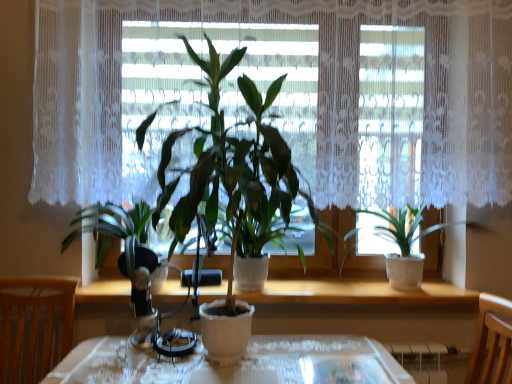
You are a GUI agent. You are given a task and a screenshot of the screen. Output one action in this format:
    pyautogui.click(x=<x>, y=<y>)
    Task: Click on the blank space situated above wooden at center (from a real-world perspective)
    The width and height of the screenshot is (512, 384).
    Given the screenshot: What is the action you would take?
    pyautogui.click(x=318, y=287)